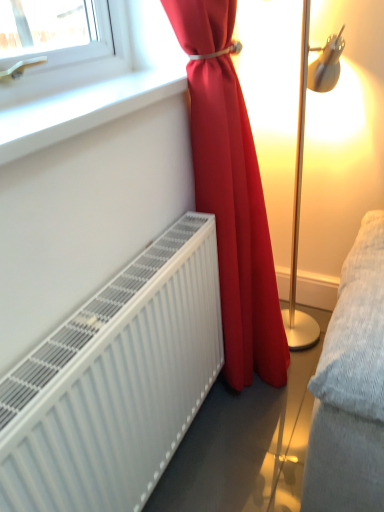
Where is `vacant region below matte red curtain at center (from a real-world perspective)`? This screenshot has width=384, height=512. vacant region below matte red curtain at center (from a real-world perspective) is located at coordinates (256, 398).